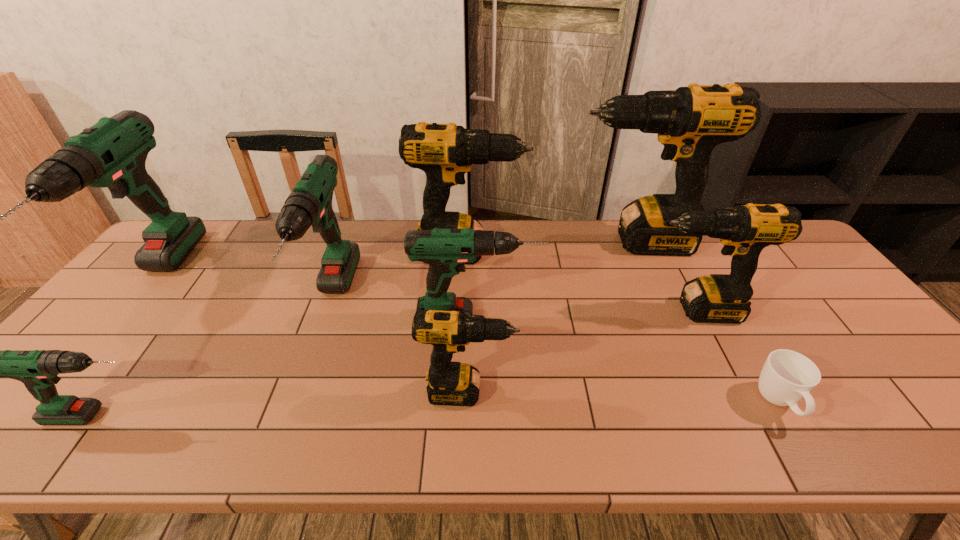
You are a GUI agent. You are given a task and a screenshot of the screen. Output one action in this format:
    pyautogui.click(x=<x>, y=<y>)
    Task: Click on the vacant area at the right edge of the desktop
    The image size is (960, 540).
    Given the screenshot: What is the action you would take?
    pyautogui.click(x=814, y=276)

Where is `vacant space that is in between the eighth tallest object and the nearest black drill`? Image resolution: width=960 pixels, height=540 pixels. vacant space that is in between the eighth tallest object and the nearest black drill is located at coordinates (286, 404).

The image size is (960, 540). I want to click on free area in between the third biggest black drill and the biggest green drill, so click(x=424, y=295).

Identify the location of blank region between the biggest green drill and the second biggest black drill. The image size is (960, 540). (311, 266).

Identify the location of free space between the third green drill from left to right and the nearest black drill. (400, 347).

At what (x,y) coordinates should I click in order to perform the action: click on vacant area that lies between the biggest black drill and the nearest black drill. Please return your answer as a coordinate pair (x, y). Looking at the image, I should click on (552, 317).

Locate an element on the screen. vacant space in between the smallest green drill and the third smallest black drill is located at coordinates (286, 334).

The height and width of the screenshot is (540, 960). In order to click on unoccupied position between the second biggest black drill and the cup in this screenshot , I will do [624, 328].

Select which object is the fourth closest to the smallest black drill. Please provide its 2D coordinates. Your answer should be formatted as a tuple, i.e. [(x, y)], where the tuple contains the x and y coordinates of a point satisfying the conditions above.

[(445, 152)]

Locate which object ranks seventh in proximity to the sixth drill from right to left. Please provide its 2D coordinates. Your answer should be formatted as a tuple, i.e. [(x, y)], where the tuple contains the x and y coordinates of a point satisfying the conditions above.

[(744, 230)]